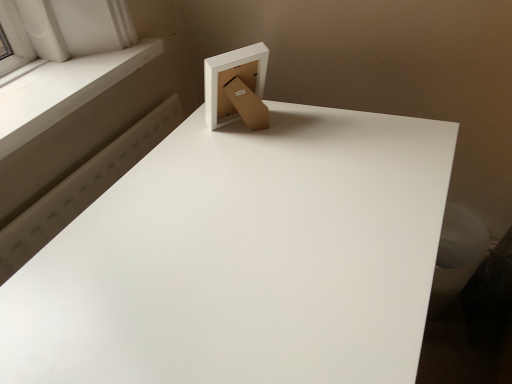
In order to click on free space above white matte table at upper center (from a real-world perspective) in this screenshot , I will do `click(259, 216)`.